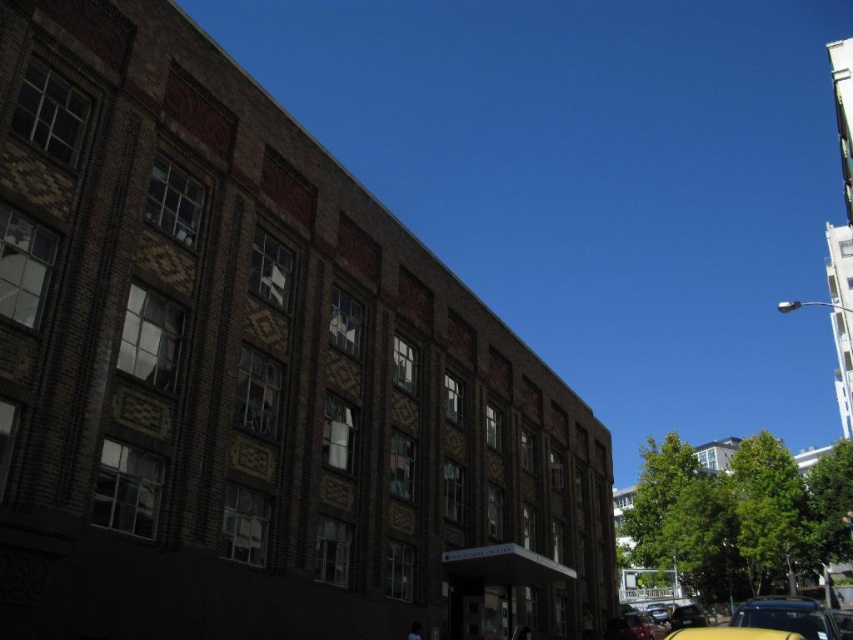
You are standing on the sidewalk in front of the multi story brick building and see the yellow rubber taxi at lower right and the shiny black car at lower right. Which one is closer to the building?

The yellow rubber taxi at lower right is closer to the building because it is positioned to the left of the shiny black car at lower right, and since both are at the lower right, the left position would be nearer to the building compared to the right side.

You are a delivery person needing to park your 3.5 meter long van between the yellow matte car at lower right and the yellow rubber taxi at lower right. Can you fit your van there?

The yellow matte car at lower right and yellow rubber taxi at lower right are 5.79 meters apart from each other. Since your van is 3.5 meters long, there is enough space to park between them as 5.79 meters is greater than 3.5 meters.

From the picture: You are standing in front of the building and want to take a photo. You notice two points marked on the building facade. The first point is at coordinates point [828,634] and the second is at point [611,621]. Which point will appear closer to the bottom edge of your photo frame?

Point [828,634] is closer to the camera than point [611,621], so it will appear closer to the bottom edge of your photo frame.